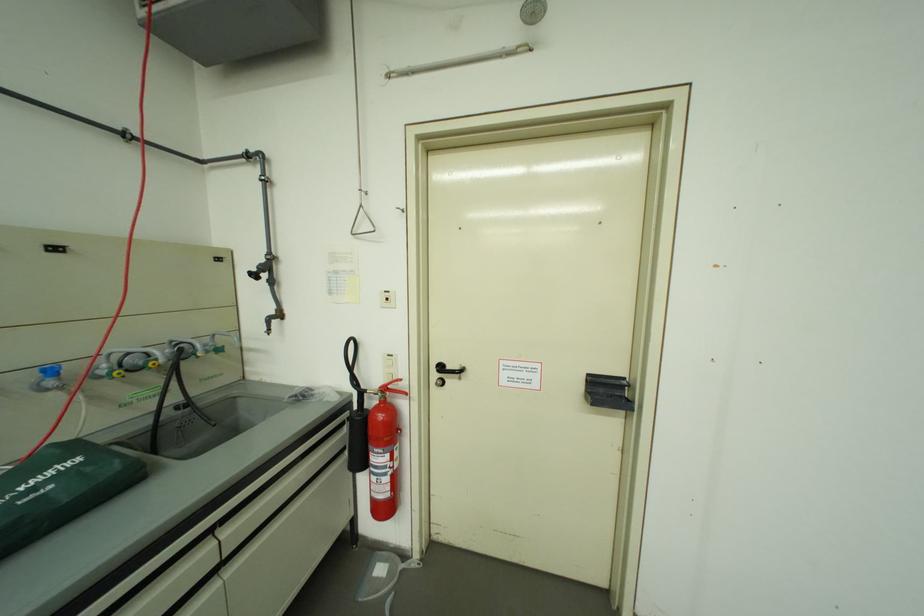
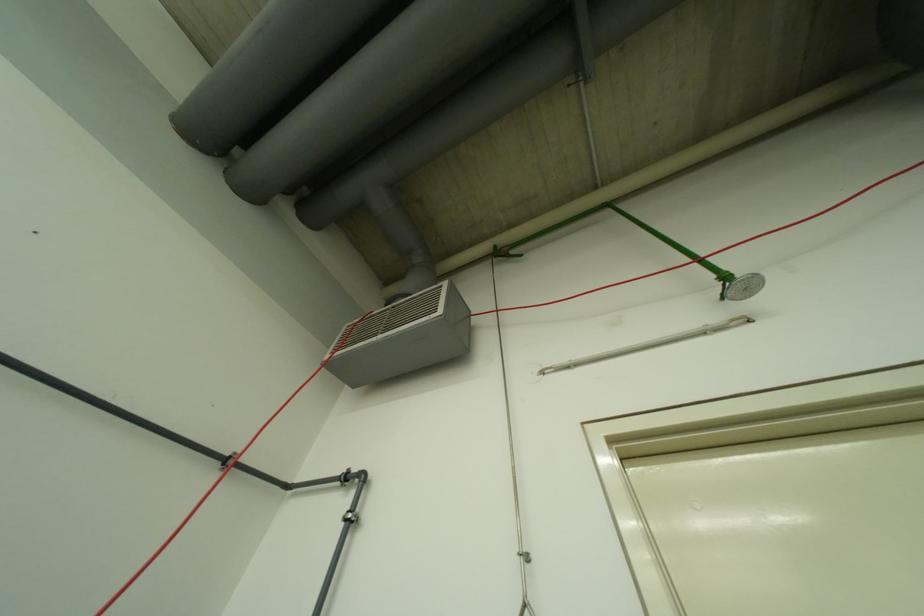
How did the camera likely rotate?

The rotation direction of the camera is left-up.